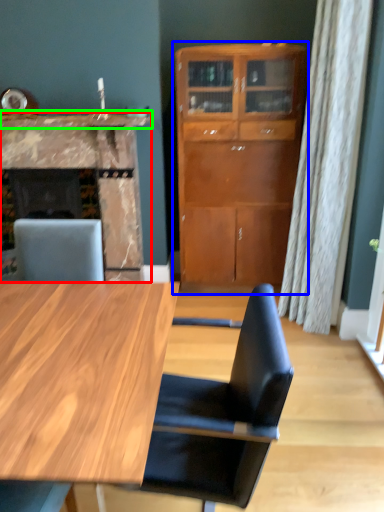
Question: Which is farther away from fireplace (highlighted by a red box)? cabinetry (highlighted by a blue box) or counter top (highlighted by a green box)?

Choices:
 (A) cabinetry
 (B) counter top

Answer: (A)